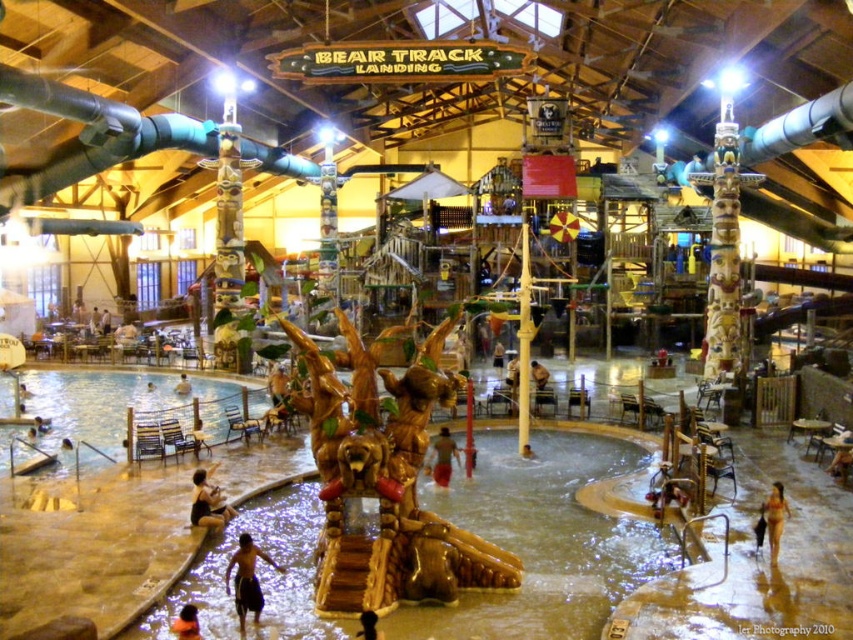
Question: Is golden wood bear at center below smooth black hair at center?

Choices:
 (A) no
 (B) yes

Answer: (A)

Question: Which point is closer to the camera?

Choices:
 (A) (354, 465)
 (B) (529, 445)
 (C) (770, 563)
 (D) (262, 604)

Answer: (D)

Question: Is wooden log slide at center positioned behind smooth concrete pool at lower left?

Choices:
 (A) no
 (B) yes

Answer: (A)

Question: Is orange fabric at lower left closer to the viewer compared to brown wooden person at center?

Choices:
 (A) no
 (B) yes

Answer: (B)

Question: Which object is positioned farthest from the wooden log slide at center?

Choices:
 (A) tan skin human at lower right
 (B) smooth black hair at center

Answer: (A)

Question: Among these points, which one is farthest from the camera?

Choices:
 (A) (770, 552)
 (B) (350, 492)
 (C) (183, 621)
 (D) (281, 570)

Answer: (A)